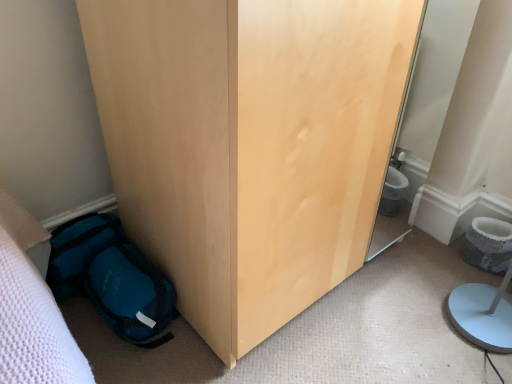
Question: From the image's perspective, is matte wood wardrobe at lower left located beneath teal fabric backpack at lower left?

Choices:
 (A) no
 (B) yes

Answer: (A)

Question: Is matte wood wardrobe at lower left taller than teal fabric backpack at lower left?

Choices:
 (A) no
 (B) yes

Answer: (B)

Question: Is matte wood wardrobe at lower left wider than teal fabric backpack at lower left?

Choices:
 (A) yes
 (B) no

Answer: (A)

Question: Is matte wood wardrobe at lower left aimed at teal fabric backpack at lower left?

Choices:
 (A) yes
 (B) no

Answer: (B)

Question: Is matte wood wardrobe at lower left at the left side of teal fabric backpack at lower left?

Choices:
 (A) yes
 (B) no

Answer: (B)

Question: From a real-world perspective, is gray textured toilet bowl at lower right positioned above or below matte wood wardrobe at lower left?

Choices:
 (A) below
 (B) above

Answer: (A)

Question: From the image's perspective, relative to matte wood wardrobe at lower left, is gray textured toilet bowl at lower right above or below?

Choices:
 (A) above
 (B) below

Answer: (B)

Question: Is gray textured toilet bowl at lower right wider or thinner than matte wood wardrobe at lower left?

Choices:
 (A) thin
 (B) wide

Answer: (A)

Question: Relative to matte wood wardrobe at lower left, is gray textured toilet bowl at lower right in front or behind?

Choices:
 (A) behind
 (B) front

Answer: (A)

Question: Looking at their shapes, would you say teal fabric backpack at lower left is wider or thinner than matte wood wardrobe at lower left?

Choices:
 (A) wide
 (B) thin

Answer: (B)

Question: From a real-world perspective, is teal fabric backpack at lower left above or below matte wood wardrobe at lower left?

Choices:
 (A) below
 (B) above

Answer: (A)

Question: In terms of height, does teal fabric backpack at lower left look taller or shorter compared to matte wood wardrobe at lower left?

Choices:
 (A) short
 (B) tall

Answer: (A)

Question: Would you say teal fabric backpack at lower left is inside or outside matte wood wardrobe at lower left?

Choices:
 (A) outside
 (B) inside

Answer: (A)

Question: Is teal fabric backpack at lower left to the left or to the right of gray textured toilet bowl at lower right in the image?

Choices:
 (A) right
 (B) left

Answer: (B)

Question: Choose the correct answer: Is teal fabric backpack at lower left inside gray textured toilet bowl at lower right or outside it?

Choices:
 (A) outside
 (B) inside

Answer: (A)